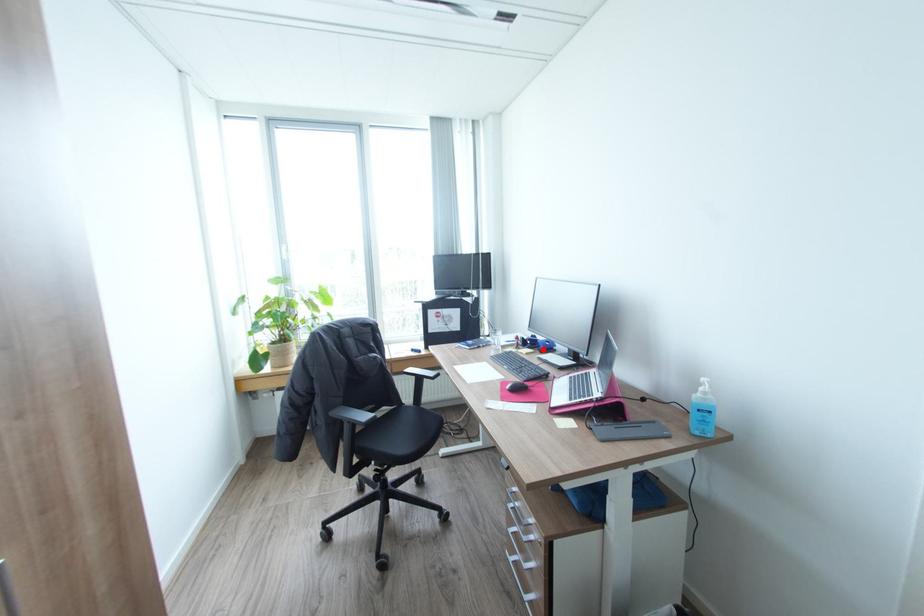
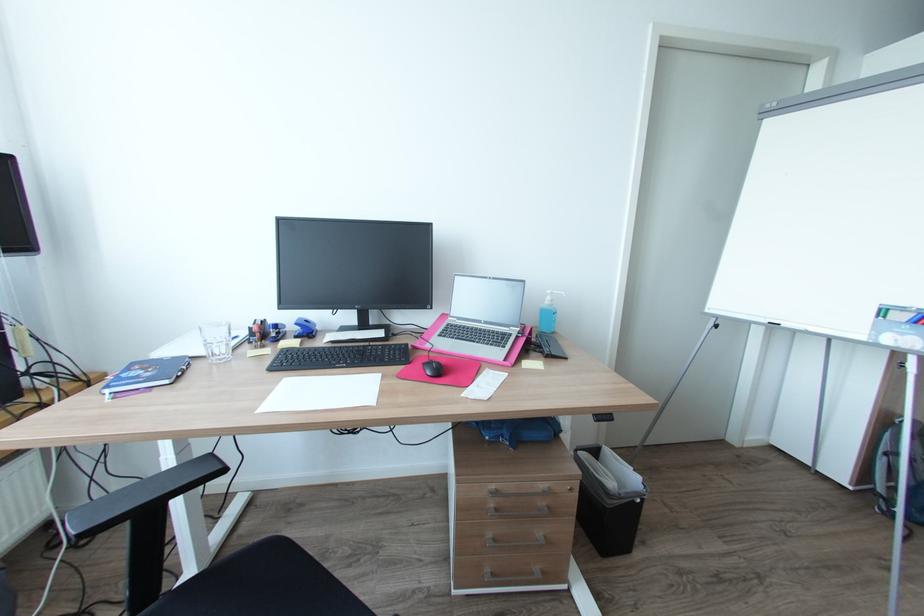
Where in the second image is the point corresponding to the highlighted location from the first image?

(301, 337)